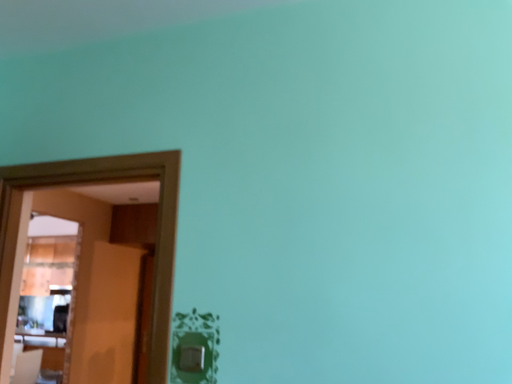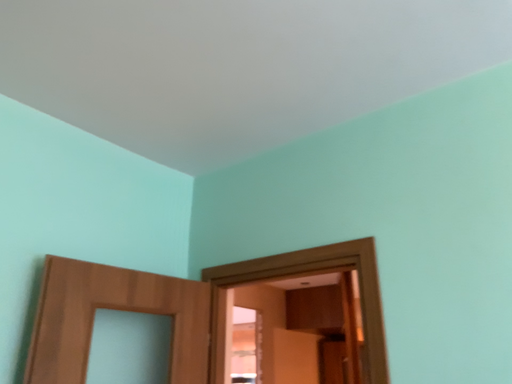
Question: How did the camera likely rotate when shooting the video?

Choices:
 (A) rotated right
 (B) rotated left

Answer: (B)